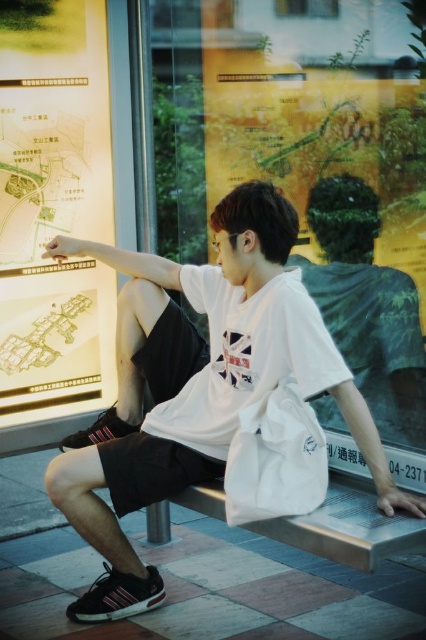
Question: Is transparent glass map at upper left below matte paper map at left?

Choices:
 (A) yes
 (B) no

Answer: (A)

Question: Which of the following is the closest to the observer?

Choices:
 (A) matte paper map at left
 (B) transparent glass map at upper left
 (C) white cotton t-shirt at center

Answer: (C)

Question: Among these points, which one is nearest to the camera?

Choices:
 (A) (331, 3)
 (B) (29, 292)
 (C) (86, 508)

Answer: (A)

Question: Is white cotton t-shirt at center below matte paper map at left?

Choices:
 (A) yes
 (B) no

Answer: (A)

Question: Which object appears closest to the camera in this image?

Choices:
 (A) white cotton t-shirt at center
 (B) matte paper map at left
 (C) transparent glass map at upper left

Answer: (A)

Question: Is transparent glass map at upper left to the right of white cotton t-shirt at center from the viewer's perspective?

Choices:
 (A) no
 (B) yes

Answer: (B)